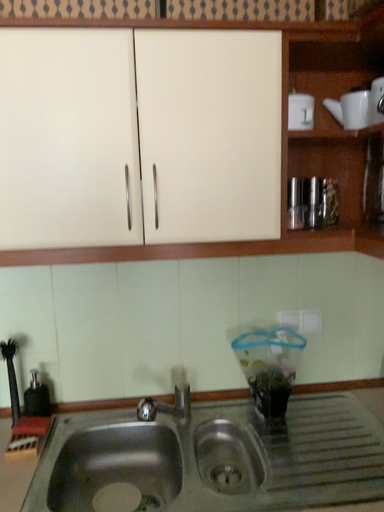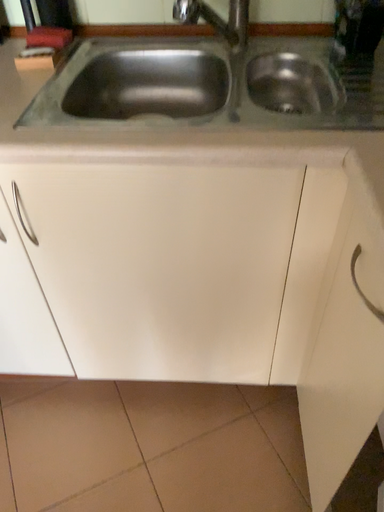
Question: How did the camera likely rotate when shooting the video?

Choices:
 (A) rotated left
 (B) rotated right

Answer: (A)